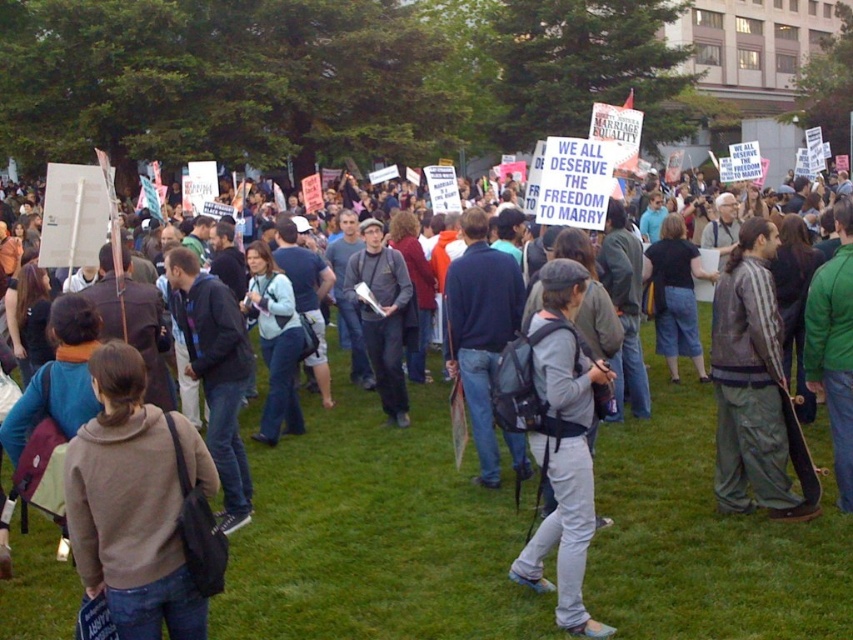
Question: Which point is closer to the camera?

Choices:
 (A) (167, 611)
 (B) (792, 412)
 (C) (552, 470)

Answer: (A)

Question: Does green grass at center have a larger size compared to light brown hoodie at center?

Choices:
 (A) no
 (B) yes

Answer: (A)

Question: In this image, where is green grass at center located relative to matte gray jacket at center?

Choices:
 (A) above
 (B) below

Answer: (B)

Question: Which object appears farthest from the camera in this image?

Choices:
 (A) green grass at center
 (B) gray fabric backpack at center

Answer: (A)

Question: Where is green grass at center located in relation to striped leather jacket at center in the image?

Choices:
 (A) right
 (B) left

Answer: (B)

Question: Which of the following is the farthest from the observer?

Choices:
 (A) (491, 552)
 (B) (550, 419)
 (C) (376, 328)
 (D) (93, 566)

Answer: (C)